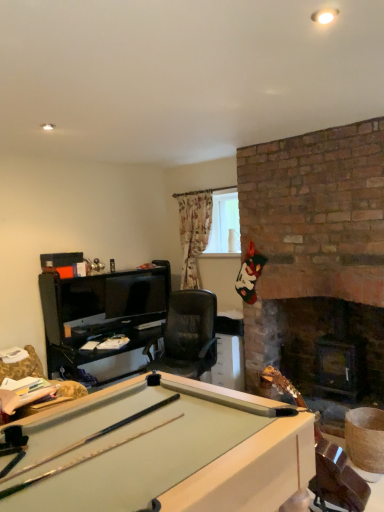
Question: From the image's perspective, is clear glass window at upper center on wooden cue stick at lower right?

Choices:
 (A) no
 (B) yes

Answer: (B)

Question: From a real-world perspective, is clear glass window at upper center located higher than wooden cue stick at lower right?

Choices:
 (A) yes
 (B) no

Answer: (A)

Question: Is clear glass window at upper center turned away from wooden cue stick at lower right?

Choices:
 (A) yes
 (B) no

Answer: (B)

Question: Is clear glass window at upper center smaller than wooden cue stick at lower right?

Choices:
 (A) no
 (B) yes

Answer: (B)

Question: Is clear glass window at upper center at the left side of wooden cue stick at lower right?

Choices:
 (A) no
 (B) yes

Answer: (B)

Question: Can you confirm if clear glass window at upper center is shorter than wooden cue stick at lower right?

Choices:
 (A) no
 (B) yes

Answer: (B)

Question: Can we say black leather swivel chair at lower left lies outside clear glass window at upper center?

Choices:
 (A) yes
 (B) no

Answer: (A)

Question: Does black leather swivel chair at lower left appear on the right side of clear glass window at upper center?

Choices:
 (A) yes
 (B) no

Answer: (B)

Question: Does black leather swivel chair at lower left lie in front of clear glass window at upper center?

Choices:
 (A) yes
 (B) no

Answer: (A)

Question: From the image's perspective, is black leather swivel chair at lower left located above clear glass window at upper center?

Choices:
 (A) no
 (B) yes

Answer: (A)

Question: Are black leather swivel chair at lower left and clear glass window at upper center making contact?

Choices:
 (A) no
 (B) yes

Answer: (A)

Question: Does black leather swivel chair at lower left have a greater height compared to clear glass window at upper center?

Choices:
 (A) no
 (B) yes

Answer: (A)

Question: Does clear glass window at upper center have a smaller size compared to black leather swivel chair at lower left?

Choices:
 (A) no
 (B) yes

Answer: (B)